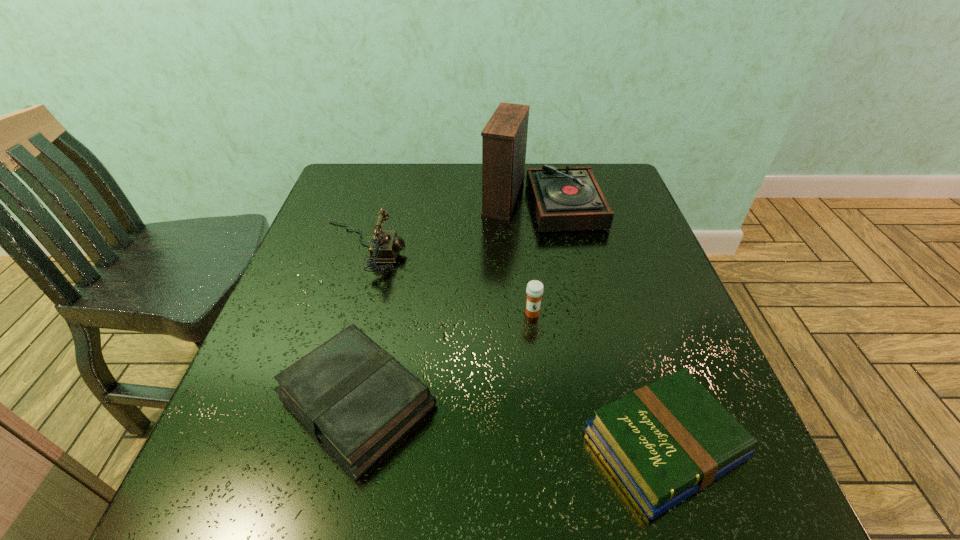
Find the location of a particular element. Image resolution: width=960 pixels, height=540 pixels. vacant area that lies between the phonograph record and the third shortest object is located at coordinates (537, 257).

You are a GUI agent. You are given a task and a screenshot of the screen. Output one action in this format:
    pyautogui.click(x=<x>, y=<y>)
    Task: Click on the free spot between the tallest object and the third shortest object
    This screenshot has height=540, width=960.
    Given the screenshot: What is the action you would take?
    pyautogui.click(x=537, y=257)

You are a GUI agent. You are given a task and a screenshot of the screen. Output one action in this format:
    pyautogui.click(x=<x>, y=<y>)
    Task: Click on the free point between the tallest object and the left book
    The height and width of the screenshot is (540, 960).
    Given the screenshot: What is the action you would take?
    pyautogui.click(x=448, y=301)

In order to click on free spot between the left book and the fourth shortest object in this screenshot , I will do `click(360, 324)`.

You are a GUI agent. You are given a task and a screenshot of the screen. Output one action in this format:
    pyautogui.click(x=<x>, y=<y>)
    Task: Click on the free space between the fourth shortest object and the phonograph record
    
    Given the screenshot: What is the action you would take?
    pyautogui.click(x=451, y=224)

This screenshot has width=960, height=540. Identify the location of free spot between the left book and the right book. (511, 422).

What are the coordinates of `object that is the closest to the right book` in the screenshot? It's located at (534, 290).

The image size is (960, 540). What are the coordinates of `object that is the closest to the left book` in the screenshot? It's located at (534, 290).

Identify the location of vacant space that satisfies the following two spatial constraints: 1. on the front side of the tallest object; 2. on the dial of the telephone. (549, 247).

Where is `vacant space that satisfies the following two spatial constraints: 1. on the dial of the fourth shortest object; 2. on the right side of the left book`? The image size is (960, 540). vacant space that satisfies the following two spatial constraints: 1. on the dial of the fourth shortest object; 2. on the right side of the left book is located at coordinates (315, 401).